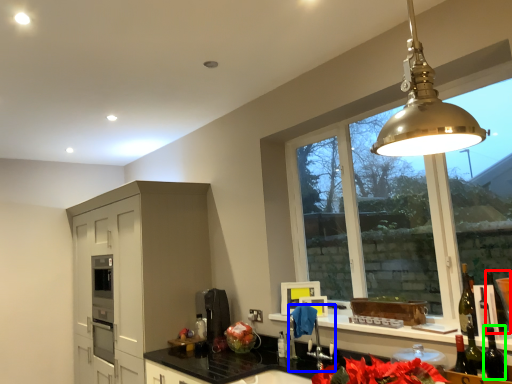
Question: Estimate the real-world distances between objects in this image. Which object is farther from wine bottle (highlighted by a red box), faucet (highlighted by a blue box) or wine bottle (highlighted by a green box)?

Choices:
 (A) faucet
 (B) wine bottle

Answer: (A)